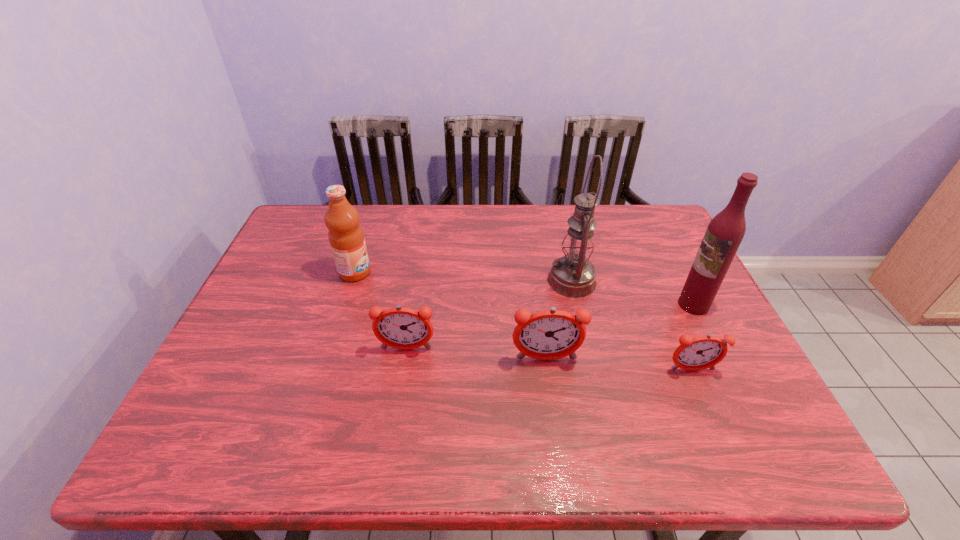
Where is `the second shortest object`? the second shortest object is located at coordinates (402, 328).

You are a GUI agent. You are given a task and a screenshot of the screen. Output one action in this format:
    pyautogui.click(x=<x>, y=<y>)
    Task: Click on the second tallest alarm clock
    Image resolution: width=960 pixels, height=540 pixels.
    Given the screenshot: What is the action you would take?
    pyautogui.click(x=402, y=328)

Locate an element on the screen. the second alarm clock from right to left is located at coordinates (552, 334).

This screenshot has height=540, width=960. Find the location of `the rightmost alarm clock`. the rightmost alarm clock is located at coordinates point(702,352).

I want to click on the shortest object, so click(702, 352).

The height and width of the screenshot is (540, 960). I want to click on oil lamp, so click(572, 275).

Locate an element on the screen. liquor is located at coordinates (724, 234).

I want to click on fruit juice, so click(346, 237).

The image size is (960, 540). I want to click on the leftmost object, so click(x=346, y=237).

This screenshot has height=540, width=960. In order to click on free space located 0.130m on the front-facing side of the leftmost alarm clock in this screenshot , I will do `click(398, 401)`.